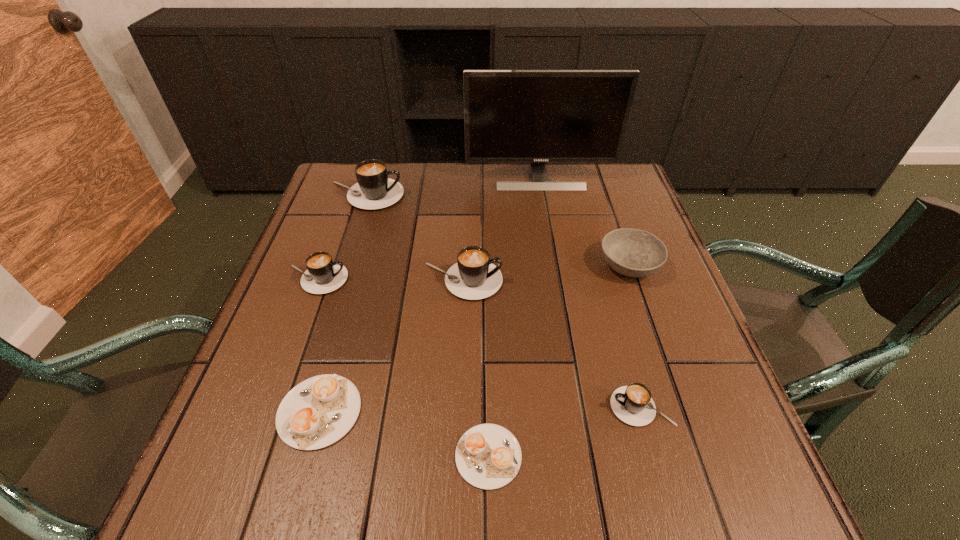
Where is `monitor`? The height and width of the screenshot is (540, 960). monitor is located at coordinates (537, 116).

The height and width of the screenshot is (540, 960). In order to click on the farthest cappuccino in this screenshot , I will do `click(374, 190)`.

At what (x,y) coordinates should I click in order to perform the action: click on the biggest black cappuccino. Please return your answer as a coordinate pair (x, y). Looking at the image, I should click on [x=374, y=190].

You are a GUI agent. You are given a task and a screenshot of the screen. Output one action in this format:
    pyautogui.click(x=<x>, y=<y>)
    Task: Click on the third tallest object
    Image resolution: width=960 pixels, height=540 pixels.
    Given the screenshot: What is the action you would take?
    pyautogui.click(x=473, y=277)

This screenshot has height=540, width=960. I want to click on the second biggest black cappuccino, so click(x=473, y=277).

The height and width of the screenshot is (540, 960). What are the coordinates of `the fourth shortest cappuccino` in the screenshot? It's located at (x=322, y=276).

Image resolution: width=960 pixels, height=540 pixels. Find the location of `bowl`. bowl is located at coordinates (631, 252).

Identify the location of the fourth tallest cappuccino. This screenshot has height=540, width=960. (632, 404).

You are a GUI agent. You are given a task and a screenshot of the screen. Output one action in this format:
    pyautogui.click(x=<x>, y=<y>)
    Task: Click on the smallest black cappuccino
    
    Given the screenshot: What is the action you would take?
    pyautogui.click(x=632, y=404)

This screenshot has width=960, height=540. I want to click on the bigger white cappuccino, so click(x=319, y=411).